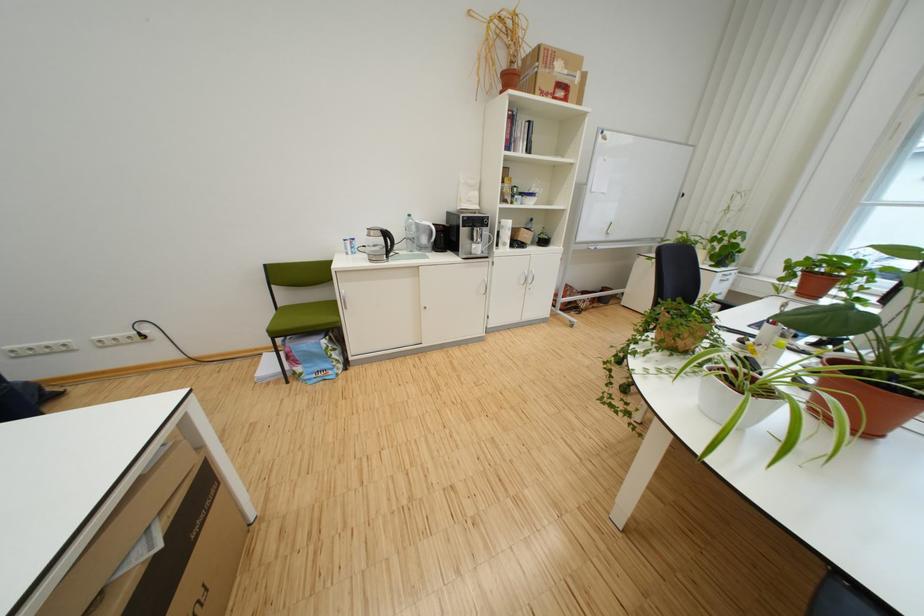
Find where to lift the glass kettle handle. Please return your answer as a coordinate pair (x, y).

(382, 238)